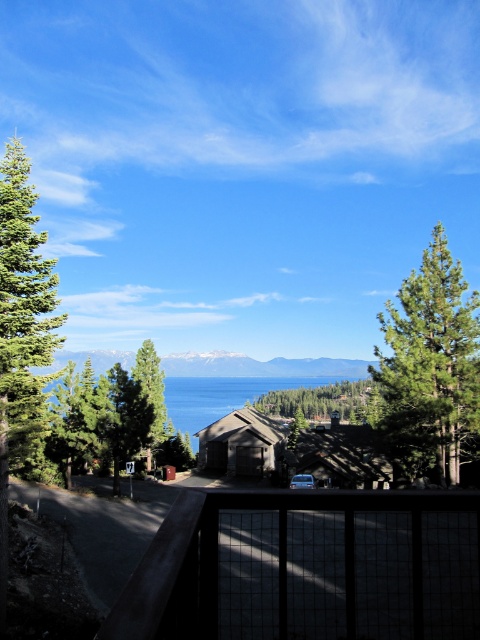
You are standing on a balcony and see two green trees at the center of the scene, one labeled as green textured tree at center and the other as green matte tree at center. Which tree would appear closer to you?

The green textured tree at center appears closer to you because it is positioned further to the viewer than the green matte tree at center.

You are standing on a balcony and looking out at the landscape. There is a point marked at coordinates (307, 566). What object is located at that point?

The point at coordinates (307, 566) indicates a dark gray grid patterned deck at center.

You are standing on a balcony and want to locate the matte brown cabin at center. According to the coordinates provided, where would you find it?

The matte brown cabin at center is located at coordinates point (342, 456).